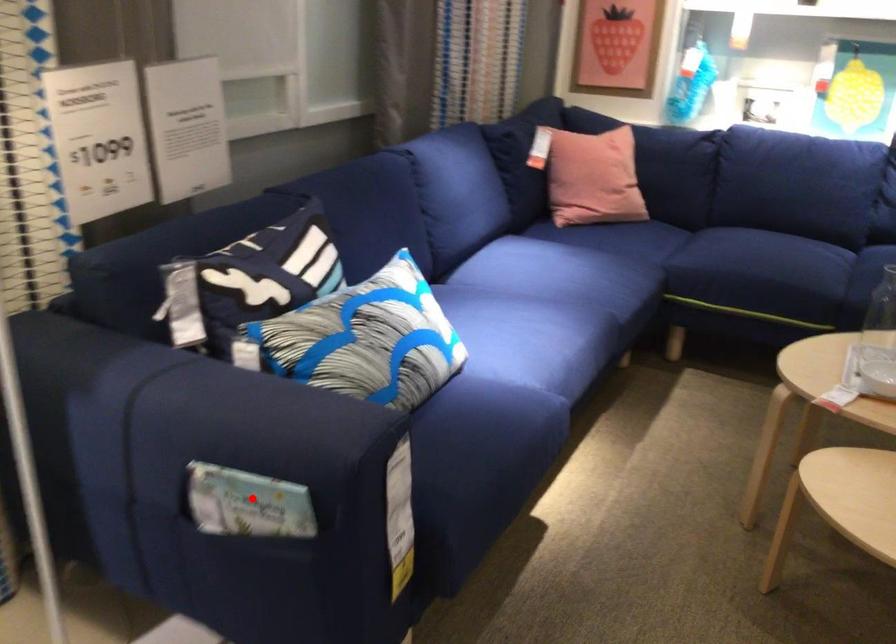
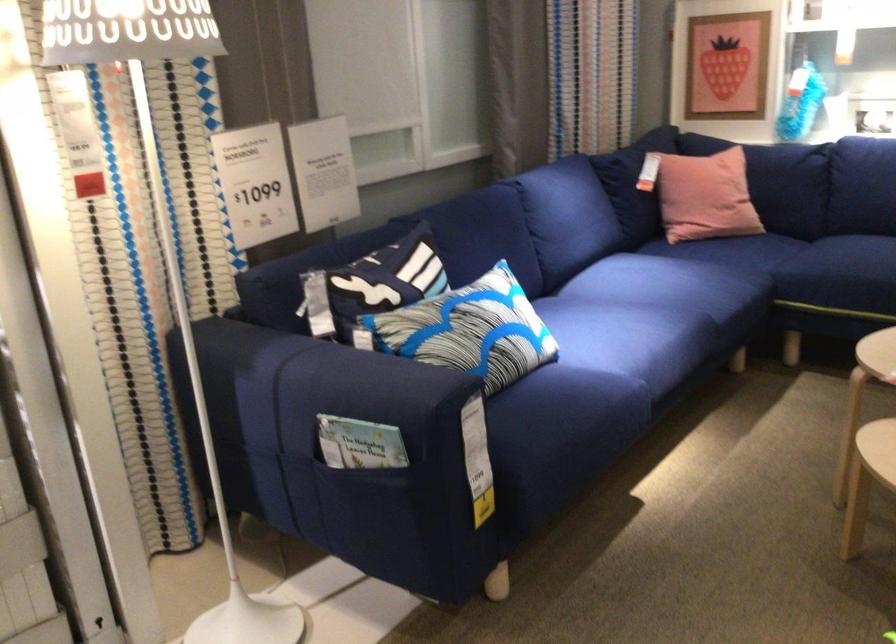
Question: I am providing you with two images of the same scene from different viewpoints. A red point is shown in image1. For the corresponding object point in image2, is it positioned nearer or farther from the camera?

Choices:
 (A) Nearer
 (B) Farther

Answer: (B)